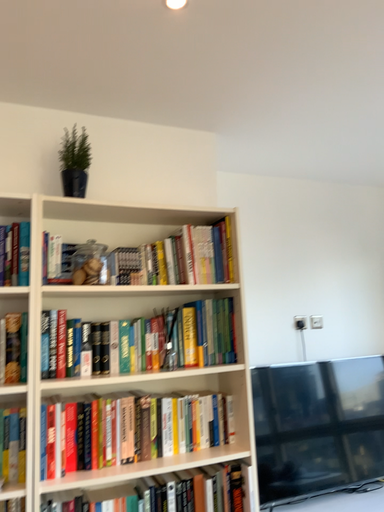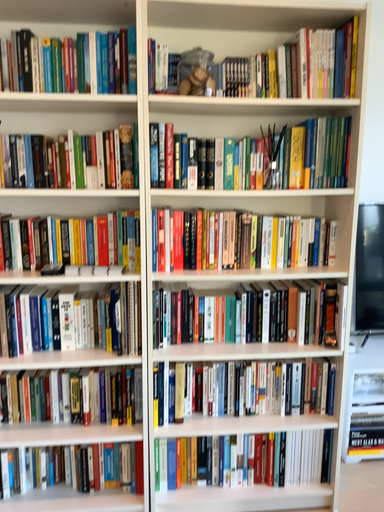
Question: Which way did the camera rotate in the video?

Choices:
 (A) rotated downward
 (B) rotated upward

Answer: (A)